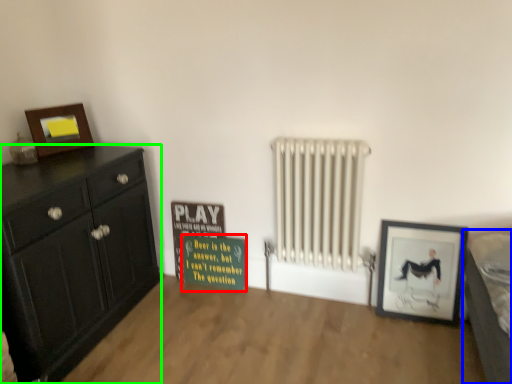
Question: Which object is the closest to the warning sign (highlighted by a red box)? Choose among these: bed (highlighted by a blue box) or chest of drawers (highlighted by a green box).

Choices:
 (A) bed
 (B) chest of drawers

Answer: (B)